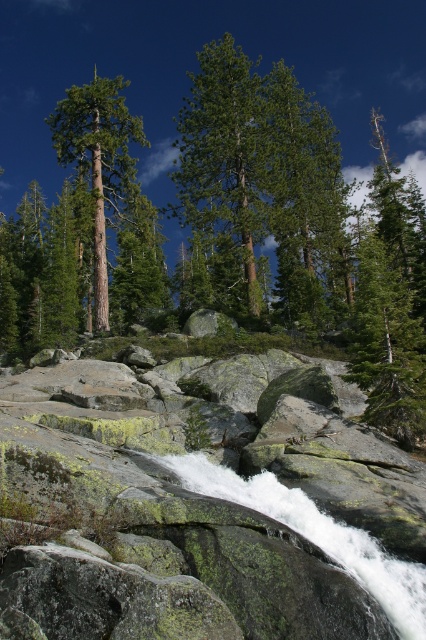
Question: Is green mossy rock at center bigger than green matte tree at left?

Choices:
 (A) no
 (B) yes

Answer: (A)

Question: Which point is closer to the camera?

Choices:
 (A) (204, 525)
 (B) (94, 157)

Answer: (A)

Question: Is green mossy rock at center wider than green matte tree at left?

Choices:
 (A) no
 (B) yes

Answer: (A)

Question: Can you confirm if green mossy rock at center is positioned below green matte tree at left?

Choices:
 (A) yes
 (B) no

Answer: (A)